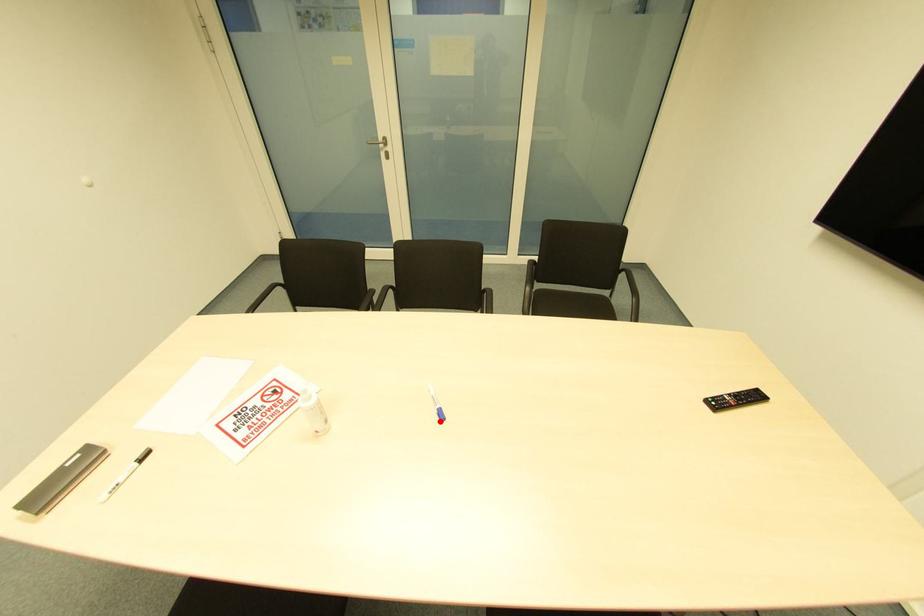
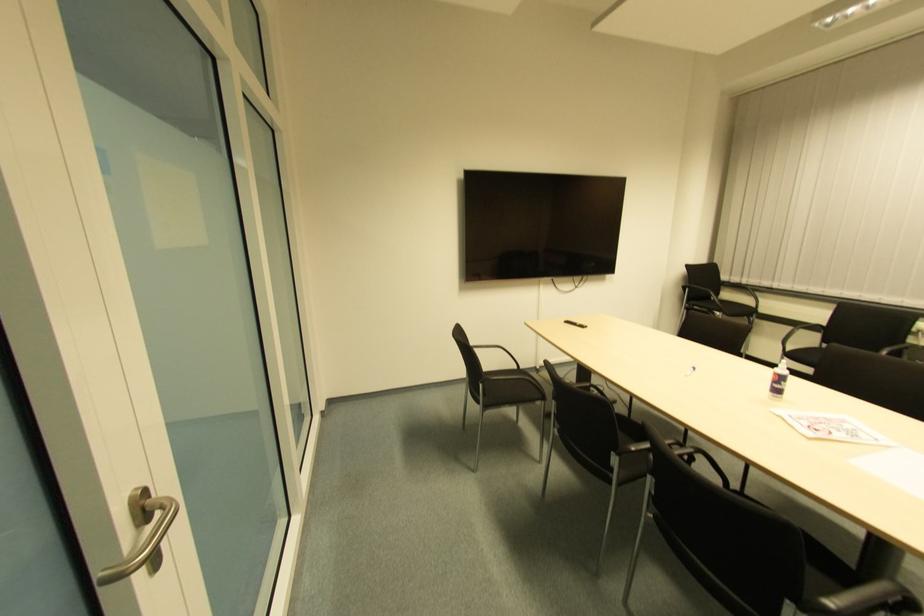
Where in the second image is the point corresponding to the highlighted location from the first image?

(691, 371)